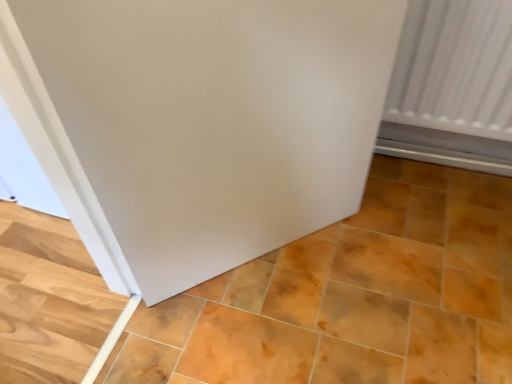
Image resolution: width=512 pixels, height=384 pixels. Find the location of `matte orange tile at center`. matte orange tile at center is located at coordinates (353, 296).

This screenshot has width=512, height=384. Describe the element at coordinates (353, 296) in the screenshot. I see `matte orange tile at center` at that location.

In order to face white matte door at center, should I rotate leftwards or rightwards?

To face it directly, rotate right by 0.488 degrees.

The height and width of the screenshot is (384, 512). Find the location of `white matte door at center`. white matte door at center is located at coordinates (198, 123).

Describe the element at coordinates (198, 123) in the screenshot. I see `white matte door at center` at that location.

Where is `matte orange tile at center`? This screenshot has width=512, height=384. matte orange tile at center is located at coordinates (353, 296).

Considering the positions of objects matte orange tile at center and white matte door at center in the image provided, who is more to the right, matte orange tile at center or white matte door at center?

Positioned to the right is matte orange tile at center.

Considering the positions of objects matte orange tile at center and white matte door at center in the image provided, who is in front, matte orange tile at center or white matte door at center?

white matte door at center is closer to the camera.

Considering the positions of point (358, 311) and point (331, 83), is point (358, 311) closer or farther from the camera than point (331, 83)?

Point (358, 311) is farther from the camera than point (331, 83).

From the image's perspective, relative to white matte door at center, is matte orange tile at center above or below?

matte orange tile at center is situated lower than white matte door at center in the image.

From a real-world perspective, relative to white matte door at center, is matte orange tile at center vertically above or below?

Clearly, from a real-world perspective, matte orange tile at center is below white matte door at center.

In terms of width, does matte orange tile at center look wider or thinner when compared to white matte door at center?

Clearly, matte orange tile at center has more width compared to white matte door at center.

Who is shorter, matte orange tile at center or white matte door at center?

matte orange tile at center is shorter.

Based on the photo, in terms of size, does matte orange tile at center appear bigger or smaller than white matte door at center?

Considering their sizes, matte orange tile at center takes up more space than white matte door at center.

Choose the correct answer: Is matte orange tile at center inside white matte door at center or outside it?

matte orange tile at center is not inside white matte door at center, it's outside.

Is the surface of matte orange tile at center in direct contact with white matte door at center?

matte orange tile at center and white matte door at center are clearly separated.

Is matte orange tile at center turned away from white matte door at center?

That's not correct — matte orange tile at center is not looking away from white matte door at center.

Measure the distance from matte orange tile at center to white matte door at center.

They are 16.17 inches apart.

At what (x,y) coordinates should I click in order to perform the action: click on ceramic tile located on the right of white matte door at center. Please return your answer as a coordinate pair (x, y). Looking at the image, I should click on (353, 296).

From the picture: Between white matte door at center and matte orange tile at center, which one appears on the left side from the viewer's perspective?

Positioned to the left is white matte door at center.

Who is more distant, white matte door at center or matte orange tile at center?

Positioned behind is matte orange tile at center.

Does point (402, 18) come farther from viewer compared to point (249, 301)?

No, it is in front of (249, 301).

From the image's perspective, who appears lower, white matte door at center or matte orange tile at center?

matte orange tile at center is shown below in the image.

From a real-world perspective, is white matte door at center beneath matte orange tile at center?

Actually, white matte door at center is physically above matte orange tile at center in the real world.

Considering the sizes of white matte door at center and matte orange tile at center in the image, is white matte door at center wider or thinner than matte orange tile at center?

white matte door at center is thinner than matte orange tile at center.

Considering the sizes of white matte door at center and matte orange tile at center in the image, is white matte door at center taller or shorter than matte orange tile at center?

white matte door at center is taller than matte orange tile at center.

Which of these two, white matte door at center or matte orange tile at center, is smaller?

white matte door at center.

Would you say white matte door at center is outside matte orange tile at center?

Yes, white matte door at center is not within matte orange tile at center.

Can you see white matte door at center touching matte orange tile at center?

No, white matte door at center is not beside matte orange tile at center.

Is matte orange tile at center at the back of white matte door at center?

No, white matte door at center is not facing away from matte orange tile at center.

Find the location of a particular element. Image resolution: width=512 pixels, height=384 pixels. door located on the left of matte orange tile at center is located at coordinates (198, 123).

In order to click on door on the left of matte orange tile at center in this screenshot , I will do `click(198, 123)`.

Find the location of a particular element. The width and height of the screenshot is (512, 384). ceramic tile below the white matte door at center (from the image's perspective) is located at coordinates pos(353,296).